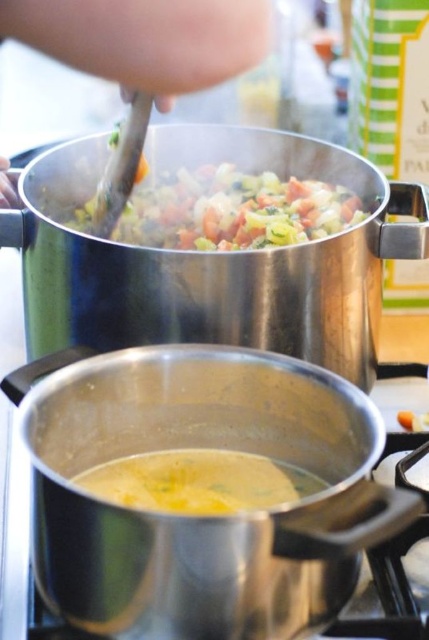
You are a chef trying to stir both the soup and the vegetable mixture. The skinny silver spoon at upper center is to the left of the vibrant mixed vegetables at upper center. Which object should you reach for first to stir the vegetables without moving the spoon first?

You should reach for the vibrant mixed vegetables at upper center first because the skinny silver spoon at upper center is to its left, meaning the vegetables are on the right side. Since you want to stir the vegetables without moving the spoon first, you need to access them directly.

Based on the photo, you are a chef trying to stir the vibrant mixed vegetables at upper center. The skinny silver spoon at upper center is in your hand. Can you stir the vegetables without moving the spoon closer to you?

The skinny silver spoon at upper center is closer to the viewer than the vibrant mixed vegetables at upper center, so yes, you can stir the vegetables without needing to move the spoon closer to you since it is already positioned in front of the vegetables.